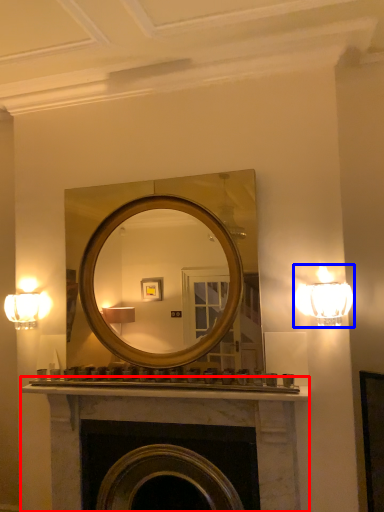
Question: Which point is closer to the camera, fireplace (highlighted by a red box) or lamp (highlighted by a blue box)?

Choices:
 (A) fireplace
 (B) lamp

Answer: (B)